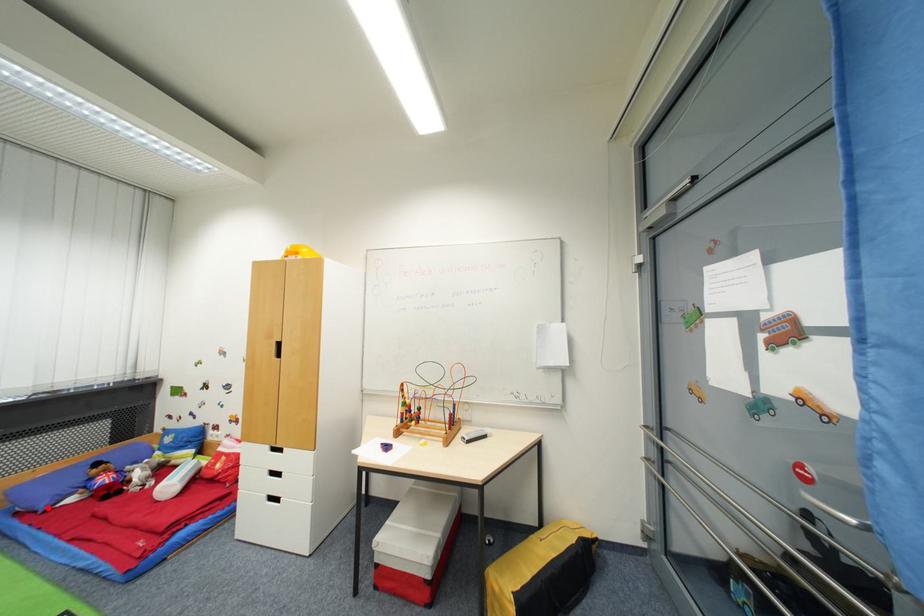
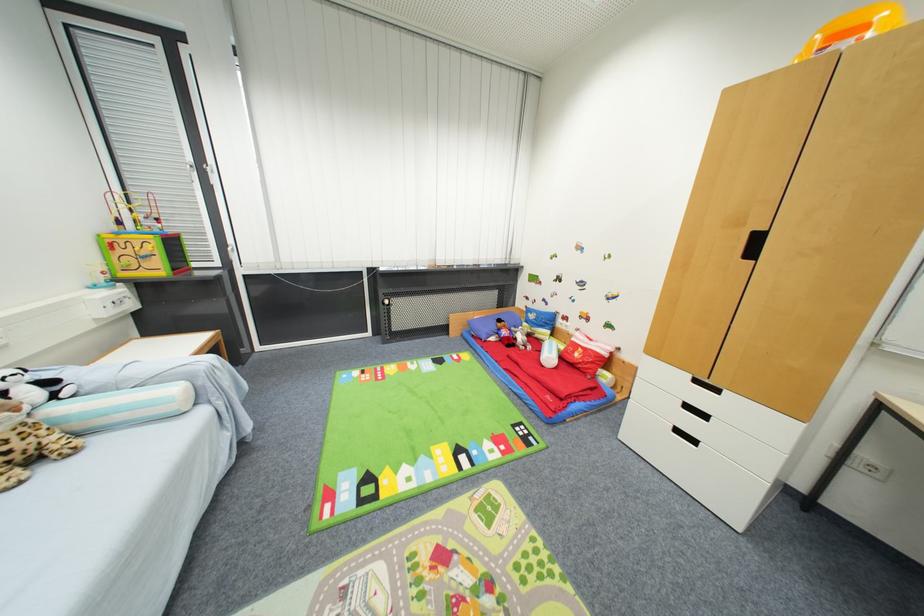
Find the pixel in the second image that matches the highlighted location in the first image.

(488, 339)